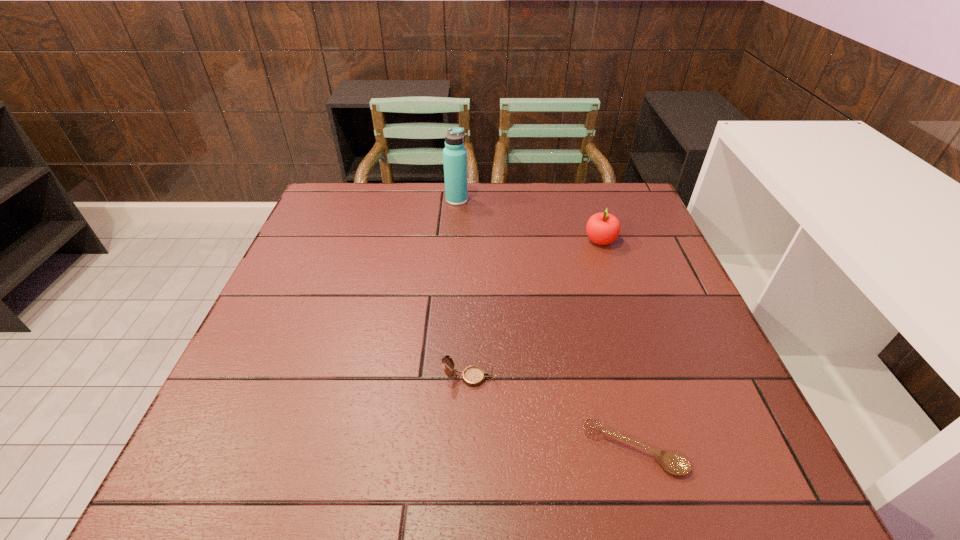
Where is `free space located on the face of the second shortest object`? The image size is (960, 540). free space located on the face of the second shortest object is located at coordinates point(601,377).

The image size is (960, 540). Identify the location of vacant position located on the back of the shortest object. (595, 309).

Locate an element on the screen. This screenshot has width=960, height=540. object positioned at the far edge is located at coordinates (x=454, y=154).

You are a GUI agent. You are given a task and a screenshot of the screen. Output one action in this format:
    pyautogui.click(x=<x>, y=<y>)
    Task: Click on the object that is positioned at the near edge
    Image resolution: width=960 pixels, height=540 pixels.
    Given the screenshot: What is the action you would take?
    pyautogui.click(x=673, y=462)

This screenshot has height=540, width=960. I want to click on apple positioned at the right edge, so click(603, 228).

Where is `ladle that is at the right edge`? ladle that is at the right edge is located at coordinates (673, 462).

Locate an element on the screen. Image resolution: width=960 pixels, height=540 pixels. object that is at the near right corner is located at coordinates (673, 462).

In the image, there is a desktop. Where is `blank space at the far edge`? blank space at the far edge is located at coordinates (473, 224).

Where is `vacant space at the near edge of the desktop`? This screenshot has width=960, height=540. vacant space at the near edge of the desktop is located at coordinates (660, 486).

Where is `vacant space at the left edge`? Image resolution: width=960 pixels, height=540 pixels. vacant space at the left edge is located at coordinates (347, 268).